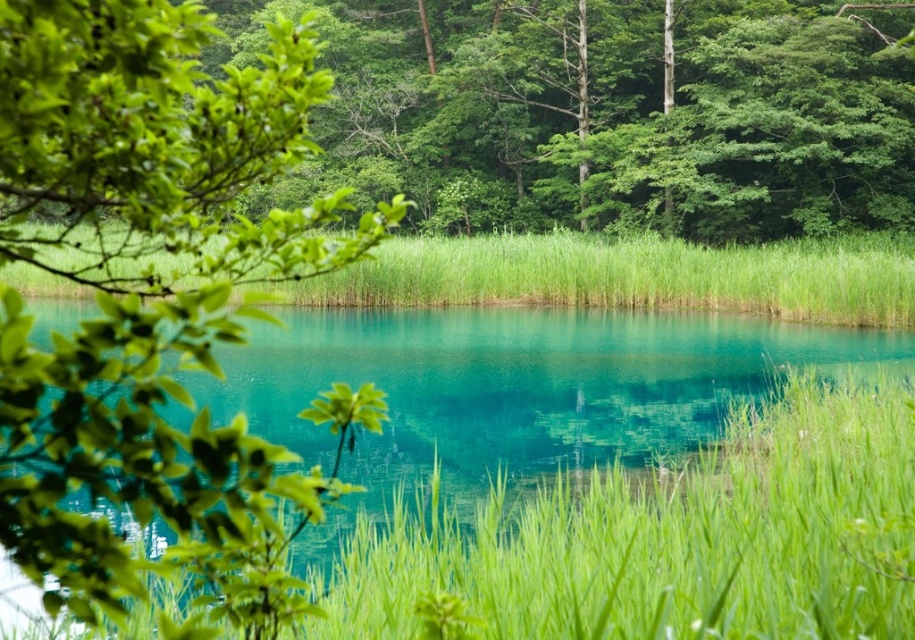
Who is positioned more to the right, green leafy tree at upper left or green grassy at center?

green grassy at center is more to the right.

Who is more distant from viewer, [229,474] or [891,276]?

Positioned behind is point [891,276].

You are a GUI agent. You are given a task and a screenshot of the screen. Output one action in this format:
    pyautogui.click(x=<x>, y=<y>)
    Task: Click on the green leafy tree at upper left
    
    Given the screenshot: What is the action you would take?
    pyautogui.click(x=140, y=269)

Is green leafy tree at upper left wider than green grass at center?

Correct, the width of green leafy tree at upper left exceeds that of green grass at center.

Measure the distance from green leafy tree at upper left to green grass at center.

green leafy tree at upper left is 7.50 meters from green grass at center.

Between point (164, 92) and point (408, 563), which one is positioned in front?

Point (164, 92)

Identify the location of green leafy tree at upper left. This screenshot has height=640, width=915. (140, 269).

Which is more to the left, green grass at center or green grassy at center?

green grassy at center

Who is more distant from viewer, (669,516) or (556,264)?

Positioned behind is point (556,264).

You are a GUI agent. You are given a task and a screenshot of the screen. Output one action in this format:
    pyautogui.click(x=<x>, y=<y>)
    Task: Click on the green grass at center
    This screenshot has height=640, width=915.
    Given the screenshot: What is the action you would take?
    pyautogui.click(x=666, y=540)